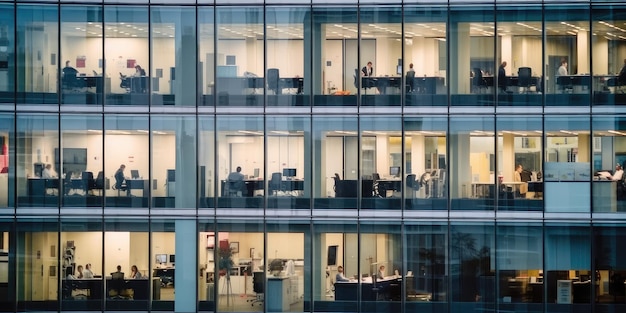
Find the location of a particular element. The width and height of the screenshot is (626, 313). computers is located at coordinates (158, 258), (330, 254), (290, 171), (254, 176), (136, 174).